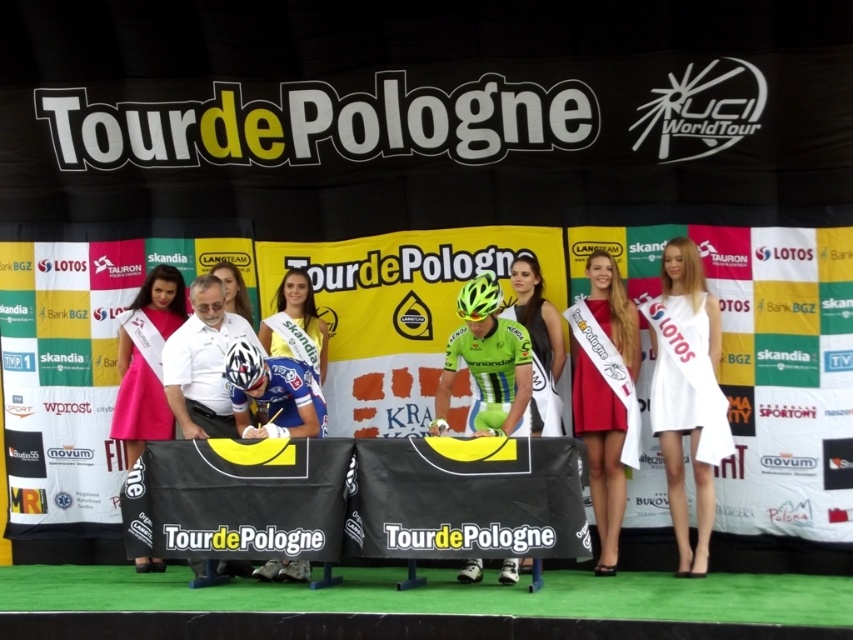
You are a photographer at the Tour de Pologne event and need to position a camera to capture the white satin dress at center. What are the coordinates where you should aim the camera?

The white satin dress at center is located at coordinates point (x=683, y=392), so aim the camera there.